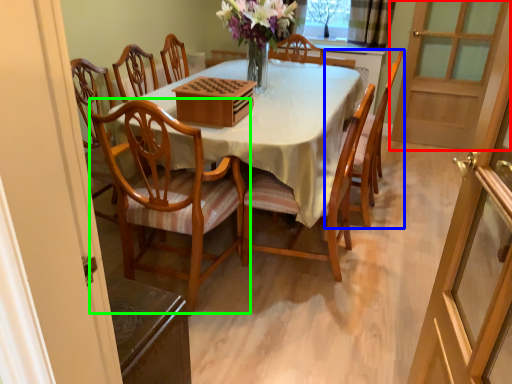
Question: Which object is positioned farthest from screen door (highlighted by a red box)? Select from chair (highlighted by a blue box) and chair (highlighted by a green box).

Choices:
 (A) chair
 (B) chair

Answer: (B)